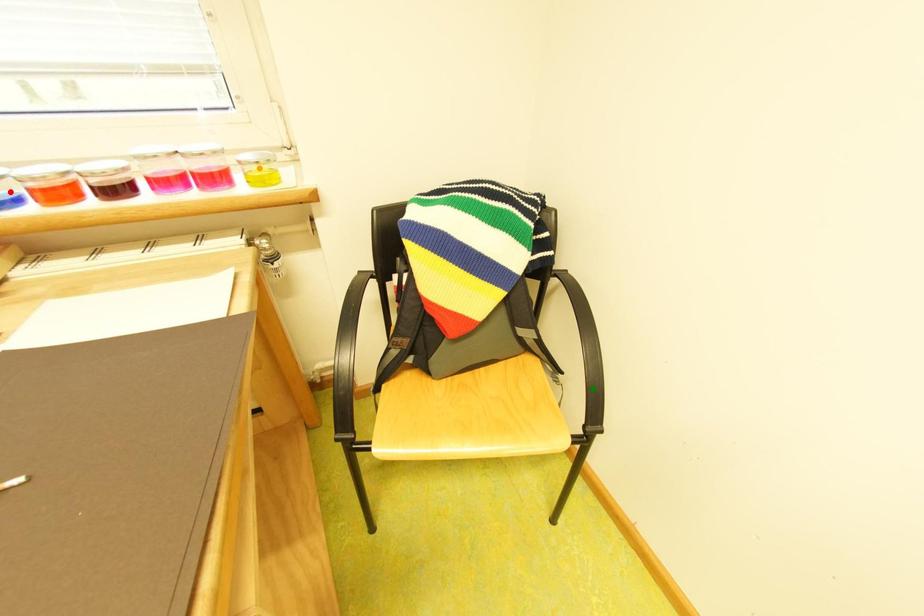
Consider the image. Order these from nearest to farthest:
- green point
- red point
- orange point

red point → orange point → green point